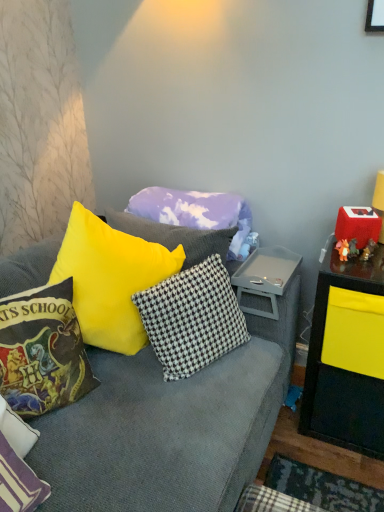
Question: Does point (291, 266) appear closer or farther from the camera than point (142, 294)?

Choices:
 (A) farther
 (B) closer

Answer: (A)

Question: Considering the positions of gray plastic tray at center and white and brown checkered pillow at center, which is the 3th pillow in front-to-back order, in the image, is gray plastic tray at center taller or shorter than white and brown checkered pillow at center, which is the 3th pillow in front-to-back order,?

Choices:
 (A) tall
 (B) short

Answer: (B)

Question: Estimate the real-world distances between objects in this image. Which object is farther from the white and brown checkered pillow at center, the second pillow when ordered from back to front?

Choices:
 (A) velvet harry potter-themed pillow at left, which ranks as the 2th pillow in front-to-back order
 (B) cloud-patterned fabric pillow at center, placed as the fourth pillow when sorted from front to back
 (C) white textured pillow at lower left, the 4th pillow when ordered from back to front
 (D) gray plastic tray at center

Answer: (C)

Question: Based on their relative distances, which object is nearer to the velvet harry potter-themed pillow at left, which is the 3th pillow from back to front?

Choices:
 (A) cloud-patterned fabric pillow at center, the 1th pillow from the back
 (B) white textured pillow at lower left, which appears as the 1th pillow when viewed from the front
 (C) white and brown checkered pillow at center, which is the 3th pillow in front-to-back order
 (D) gray plastic tray at center

Answer: (B)